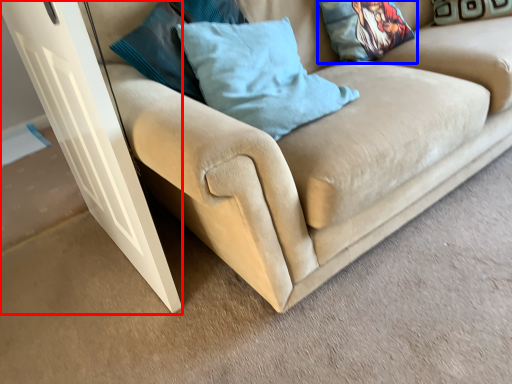
Question: Which of the following is the farthest to the observer, glass door (highlighted by a red box) or pillow (highlighted by a blue box)?

Choices:
 (A) glass door
 (B) pillow

Answer: (B)